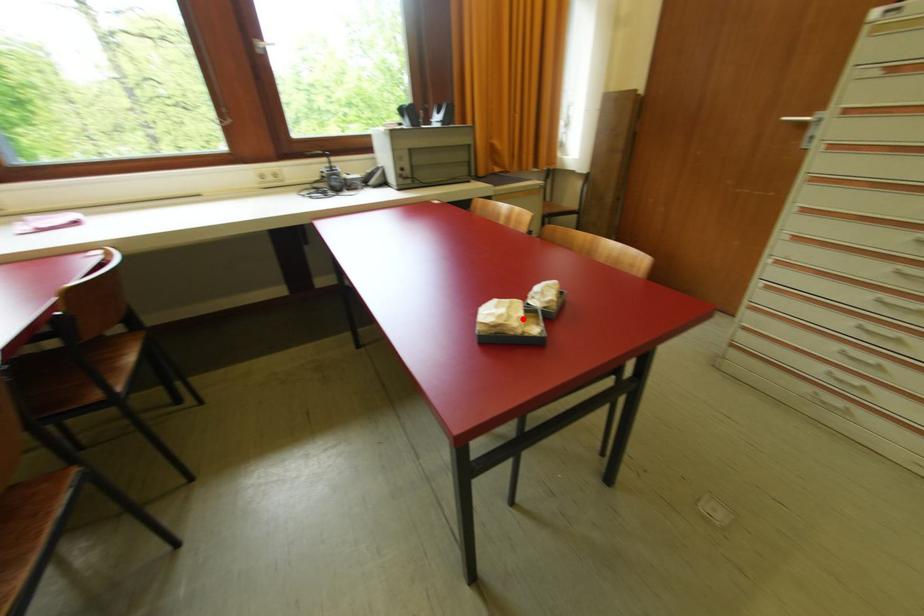
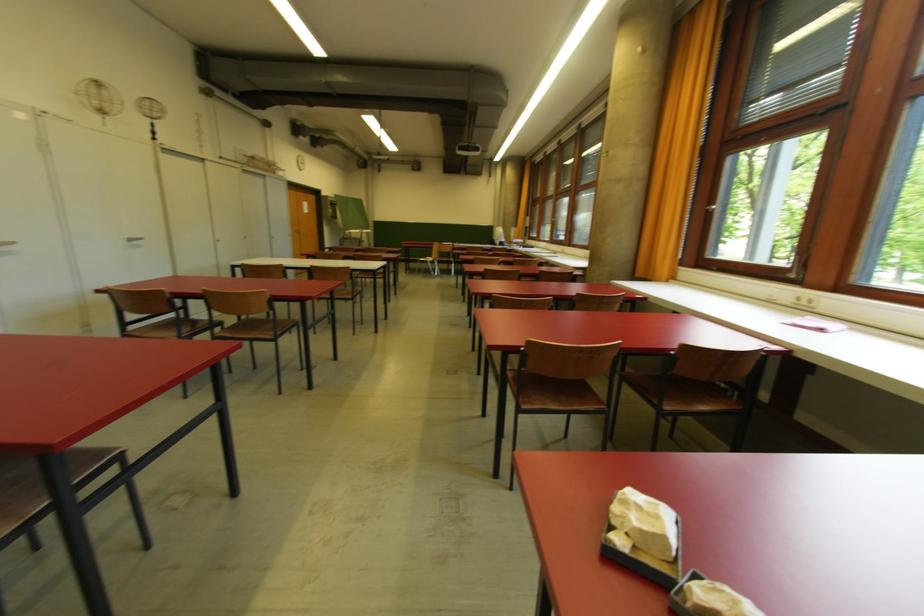
The point at the highlighted location is marked in the first image. Where is the corresponding point in the second image?

(633, 522)